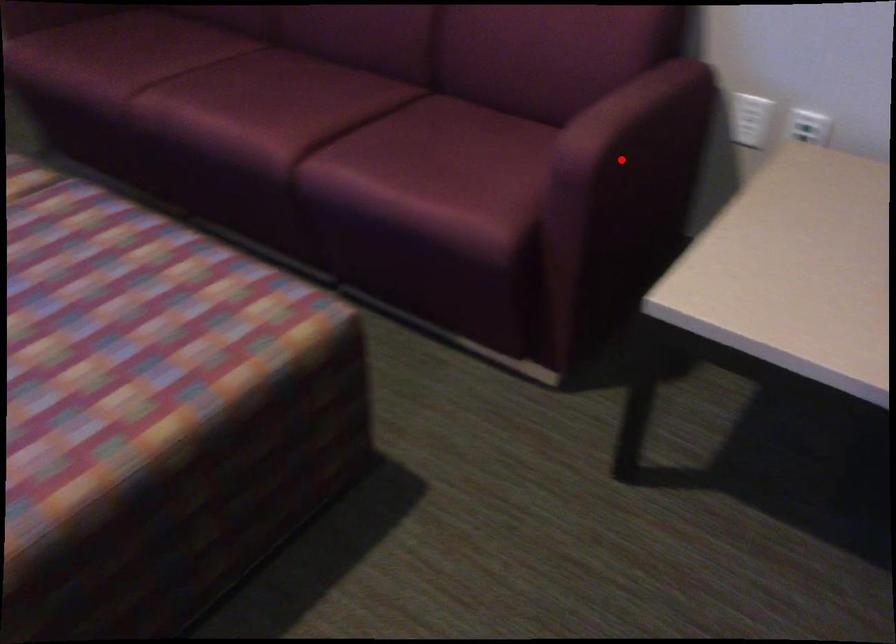
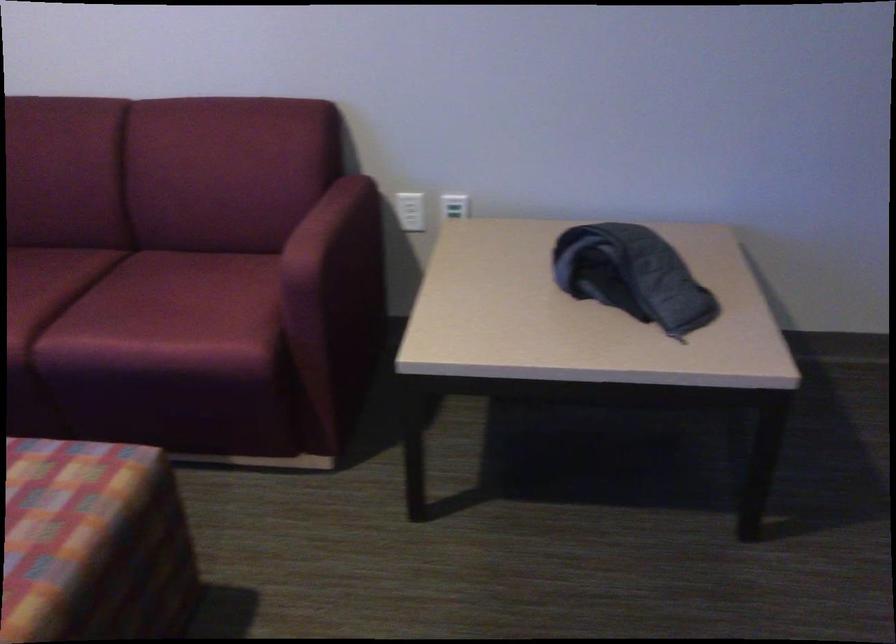
Question: I am providing you with two images of the same scene from different viewpoints. In image1, a red point is highlighted. Considering the same 3D point in image2, which of the following is correct?

Choices:
 (A) It is closer
 (B) It is farther

Answer: (B)